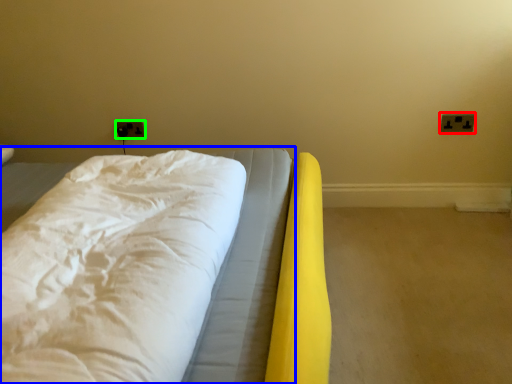
Question: Considering the real-world distances, which object is farthest from electric outlet (highlighted by a red box)? bed (highlighted by a blue box) or electric outlet (highlighted by a green box)?

Choices:
 (A) bed
 (B) electric outlet

Answer: (B)